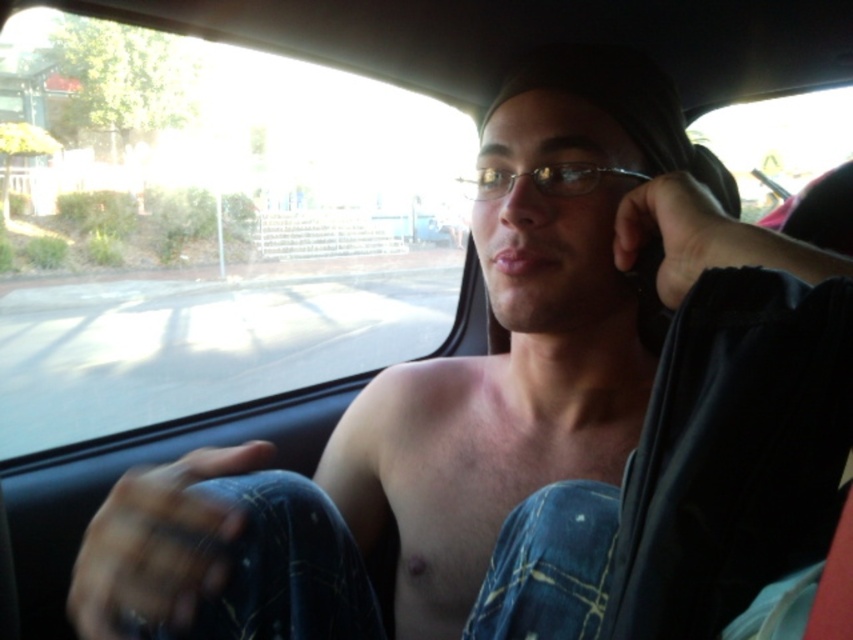
Who is taller, transparent glass car window at upper left or transparent glass car window at upper center?

transparent glass car window at upper left

Is transparent glass car window at upper left below transparent glass car window at upper center?

Yes, transparent glass car window at upper left is below transparent glass car window at upper center.

Locate an element on the screen. transparent glass car window at upper left is located at coordinates pos(207,227).